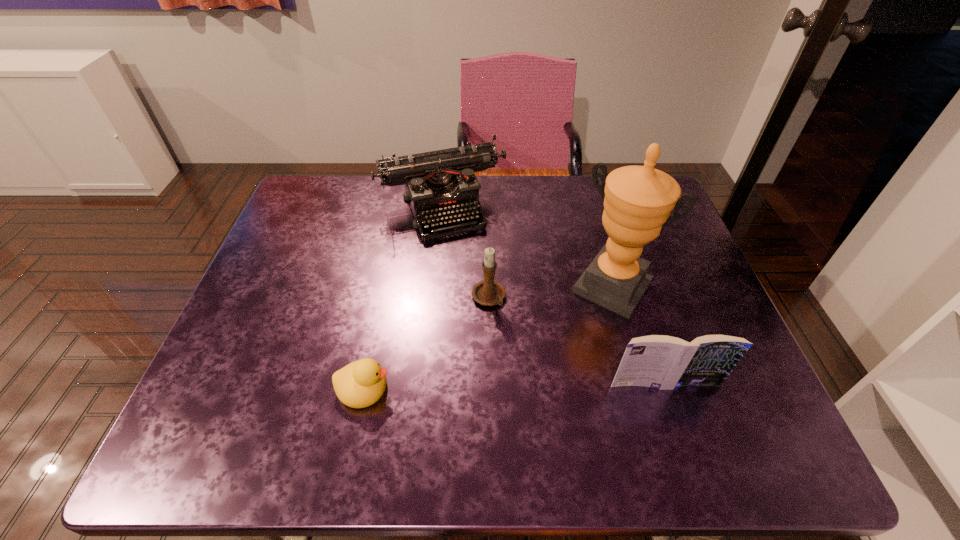
Where is `vacant space on the desktop that is between the duckling and the book and is positioned at the front of the tallest object with handles`? Image resolution: width=960 pixels, height=540 pixels. vacant space on the desktop that is between the duckling and the book and is positioned at the front of the tallest object with handles is located at coordinates (546, 386).

Locate an element on the screen. Image resolution: width=960 pixels, height=540 pixels. free space on the desktop that is between the shortest object and the book and is positioned on the keyboard of the farthest object is located at coordinates (526, 386).

Find the location of `free space on the desktop that is between the shortest object and the book and is positioned on the side of the candle holder with the handle`. free space on the desktop that is between the shortest object and the book and is positioned on the side of the candle holder with the handle is located at coordinates (531, 386).